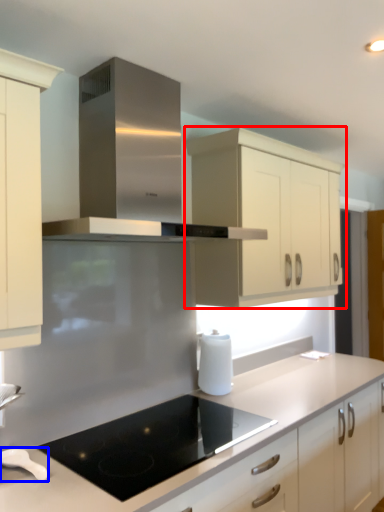
Question: Which object appears closest to the camera in this image, cabinetry (highlighted by a red box) or kitchen appliance (highlighted by a blue box)?

Choices:
 (A) cabinetry
 (B) kitchen appliance

Answer: (B)